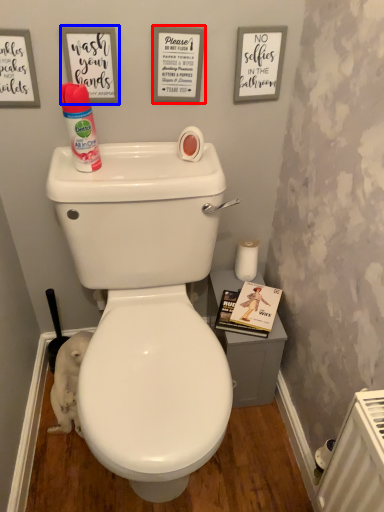
Question: Which point is further to the camera, copy (highlighted by a red box) or copy (highlighted by a blue box)?

Choices:
 (A) copy
 (B) copy

Answer: (A)